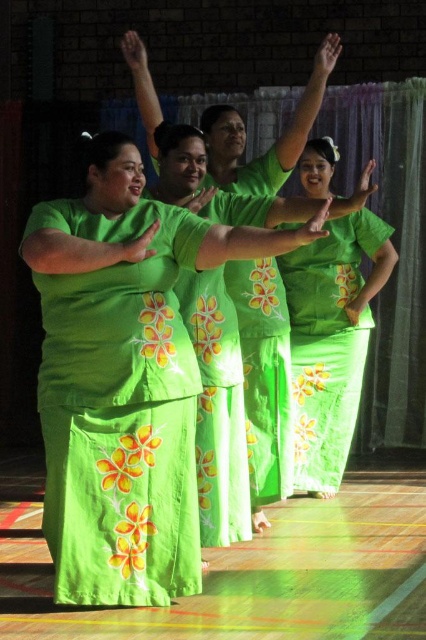
Question: Estimate the real-world distances between objects in this image. Which object is farther from the green floral fabric dress at center?

Choices:
 (A) green fabric arm at center
 (B) green satin robe at center

Answer: (B)

Question: Based on their relative distances, which object is farther from the green fabric arm at center?

Choices:
 (A) green floral fabric dress at center
 (B) green floral skirt at center
 (C) green satin robe at center
 (D) green floral dress at center

Answer: (B)

Question: Is green floral fabric dress at center positioned in front of green satin robe at center?

Choices:
 (A) no
 (B) yes

Answer: (B)

Question: In this image, where is green floral fabric dress at center located relative to green satin robe at center?

Choices:
 (A) below
 (B) above

Answer: (B)

Question: Which of these objects is positioned closest to the green floral skirt at center?

Choices:
 (A) green fabric arm at center
 (B) green floral dress at center

Answer: (B)

Question: Is green floral dress at center positioned at the back of green satin robe at center?

Choices:
 (A) no
 (B) yes

Answer: (A)